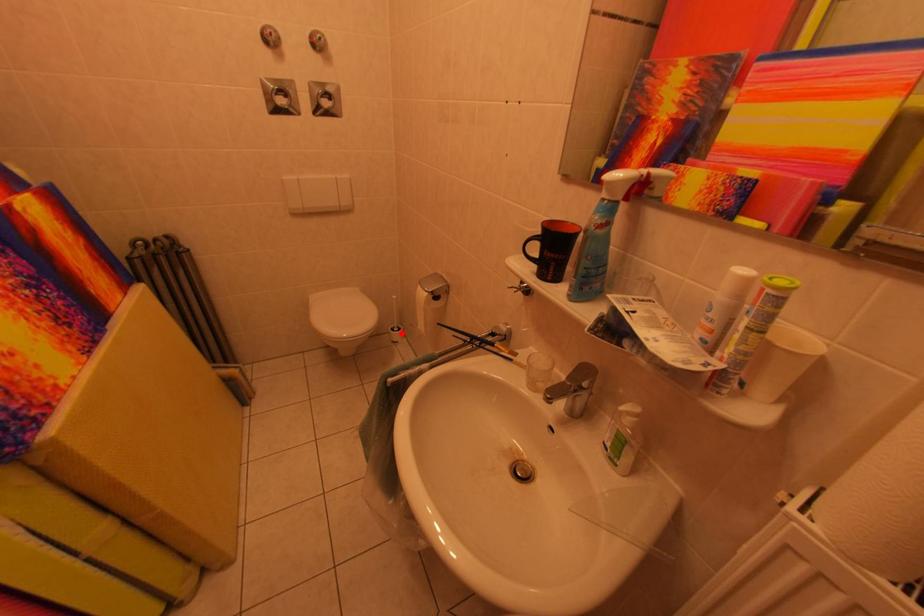
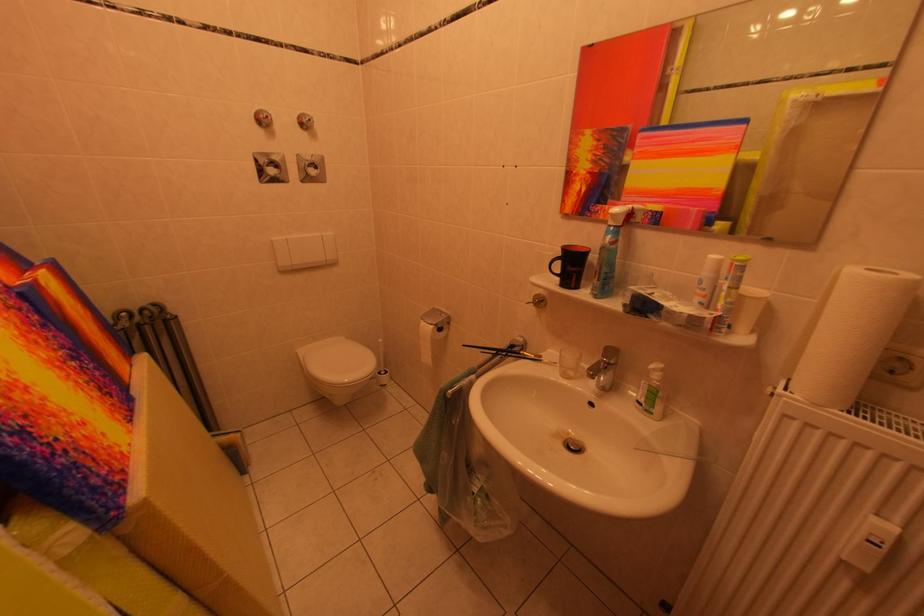
Question: A red point is marked in image1. In image2, is the corresponding 3D point closer to the camera or farther? Reply with the corresponding letter.

Choices:
 (A) The corresponding 3D point is closer.
 (B) The corresponding 3D point is farther.

Answer: (A)